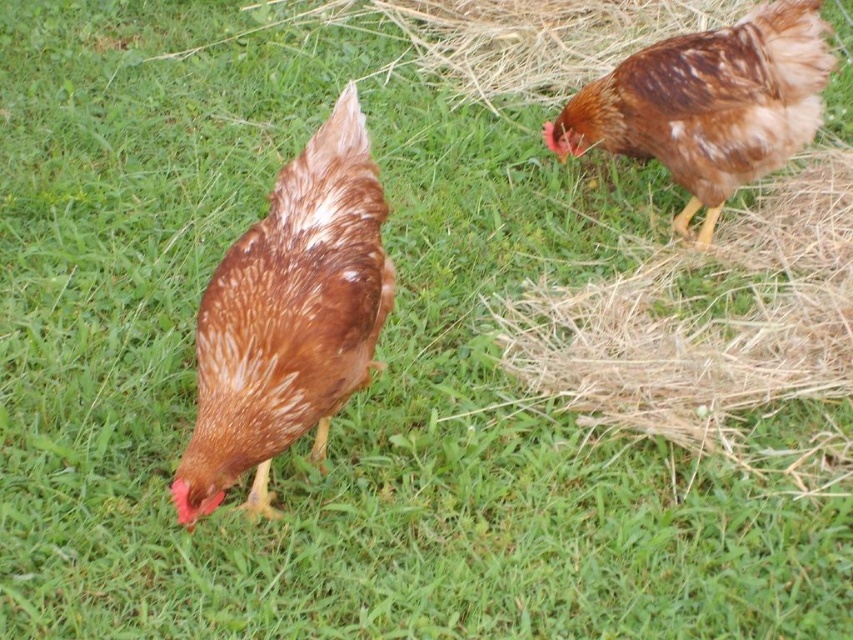
In the scene shown: Who is shorter, brown speckled feather at center or brown speckled feather at upper right?

With less height is brown speckled feather at upper right.

Is brown speckled feather at center above brown speckled feather at upper right?

No.

Who is more distant from viewer, (366,180) or (759,13)?

Point (759,13)

At what (x,y) coordinates should I click in order to perform the action: click on brown speckled feather at center. Please return your answer as a coordinate pair (x, y). This screenshot has height=640, width=853. Looking at the image, I should click on click(x=288, y=317).

Does brown straw at upper right come in front of brown speckled feather at center?

No, it is behind brown speckled feather at center.

This screenshot has width=853, height=640. Describe the element at coordinates (703, 317) in the screenshot. I see `brown straw at upper right` at that location.

The image size is (853, 640). Find the location of `brown straw at upper right`. brown straw at upper right is located at coordinates (703, 317).

Which is more to the left, brown straw at upper right or brown speckled feather at upper right?

brown speckled feather at upper right

At what (x,y) coordinates should I click in order to perform the action: click on brown straw at upper right. Please return your answer as a coordinate pair (x, y). Looking at the image, I should click on (703, 317).